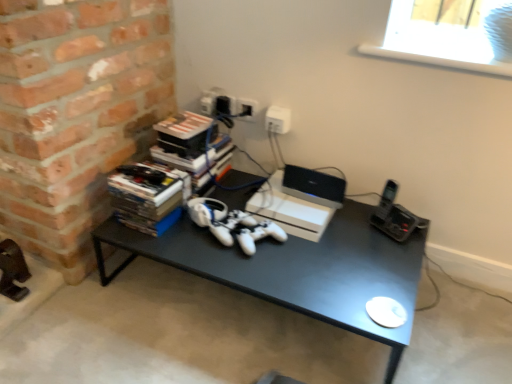
The width and height of the screenshot is (512, 384). What are the coordinates of `free space in front of hardcover books at left` in the screenshot? It's located at (150, 244).